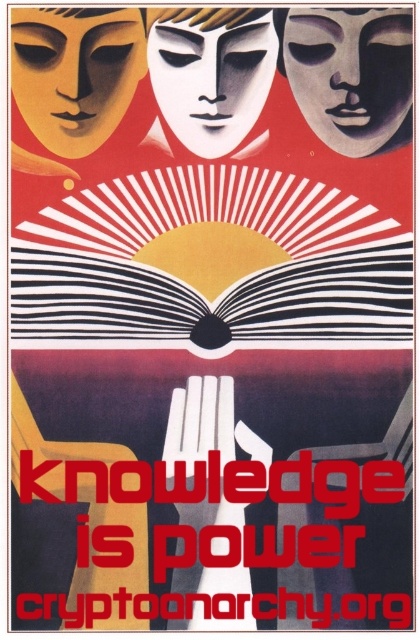
You are an artist standing 2 meters away from the poster. You want to touch the matte black mask at upper center. Can you reach it without moving closer?

The matte black mask at upper center is 2.26 meters away from the camera. Since you are standing 2 meters away, you are closer than the mask, so you can reach it without moving closer.

You are standing 2 meters away from the poster. Can you see the point at point (304,28) clearly?

The point at point (304,28) is 2.28 meters away from the camera, so you are 0.28 meters closer to the poster than the point. Since the point is part of the poster, you can see it clearly as you are within a reasonable viewing distance.